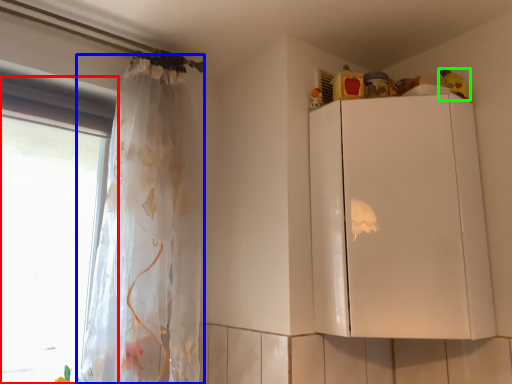
Question: Estimate the real-world distances between objects in this image. Which object is closer to window (highlighted by a red box), curtain (highlighted by a blue box) or toy (highlighted by a green box)?

Choices:
 (A) curtain
 (B) toy

Answer: (A)